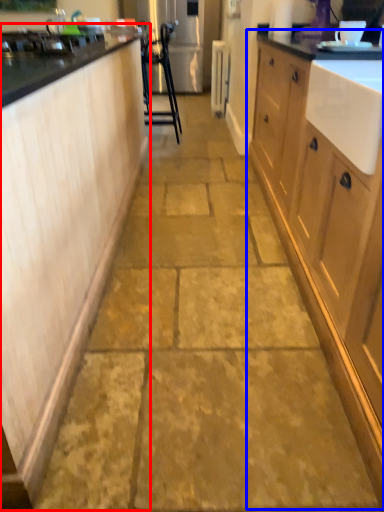
Question: Which of the following is the closest to the observer, cabinetry (highlighted by a red box) or cabinetry (highlighted by a blue box)?

Choices:
 (A) cabinetry
 (B) cabinetry

Answer: (B)